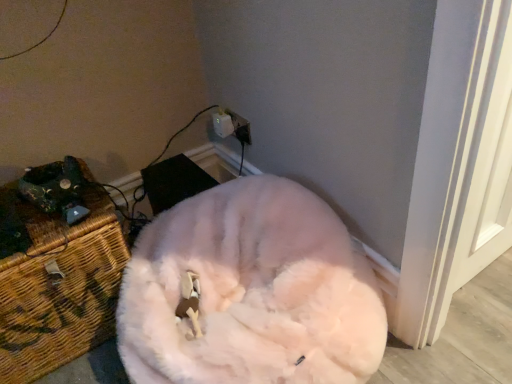
Question: In terms of size, does white fluffy cat at center appear bigger or smaller than woven wicker chest at left?

Choices:
 (A) big
 (B) small

Answer: (A)

Question: From the image's perspective, is white fluffy cat at center above or below woven wicker chest at left?

Choices:
 (A) above
 (B) below

Answer: (B)

Question: Considering the real-world distances, which object is farthest from the woven wicker chest at left?

Choices:
 (A) white fluffy cat at center
 (B) white plastic electric outlet at upper center

Answer: (B)

Question: Considering the real-world distances, which object is farthest from the white plastic electric outlet at upper center?

Choices:
 (A) white fluffy cat at center
 (B) woven wicker chest at left

Answer: (B)